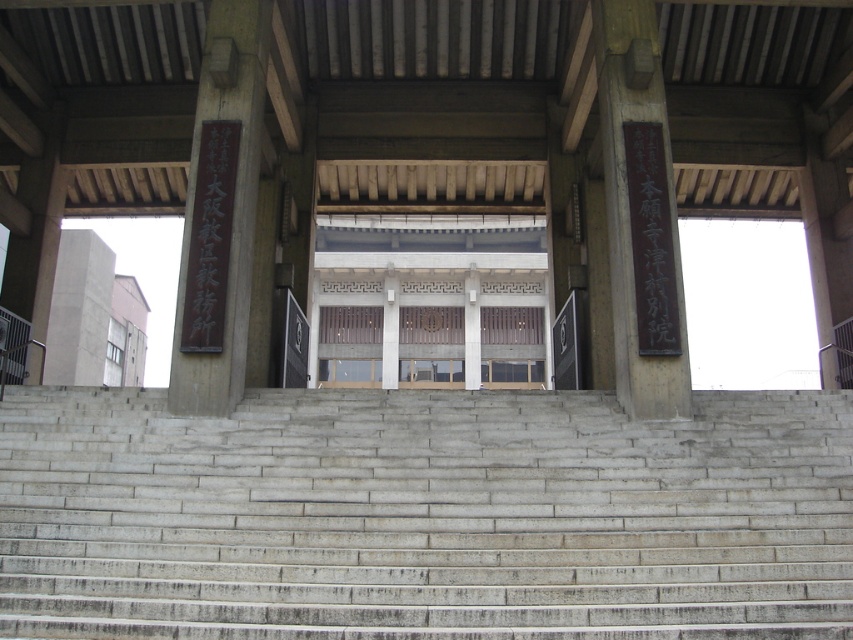
Question: Which of the following is the farthest from the observer?

Choices:
 (A) [x=233, y=225]
 (B) [x=622, y=38]
 (C) [x=821, y=566]

Answer: (B)

Question: Is gray concrete stairs at center below black polished wood sign at left?

Choices:
 (A) no
 (B) yes

Answer: (B)

Question: Does gray concrete stairs at center have a lesser width compared to black stone sign at right?

Choices:
 (A) no
 (B) yes

Answer: (A)

Question: Which of these objects is positioned farthest from the black stone sign at right?

Choices:
 (A) gray concrete stairs at center
 (B) black polished wood sign at left

Answer: (A)

Question: Is gray concrete stairs at center behind black stone sign at right?

Choices:
 (A) yes
 (B) no

Answer: (B)

Question: Which of the following is the farthest from the observer?

Choices:
 (A) (669, 349)
 (B) (224, 168)

Answer: (B)